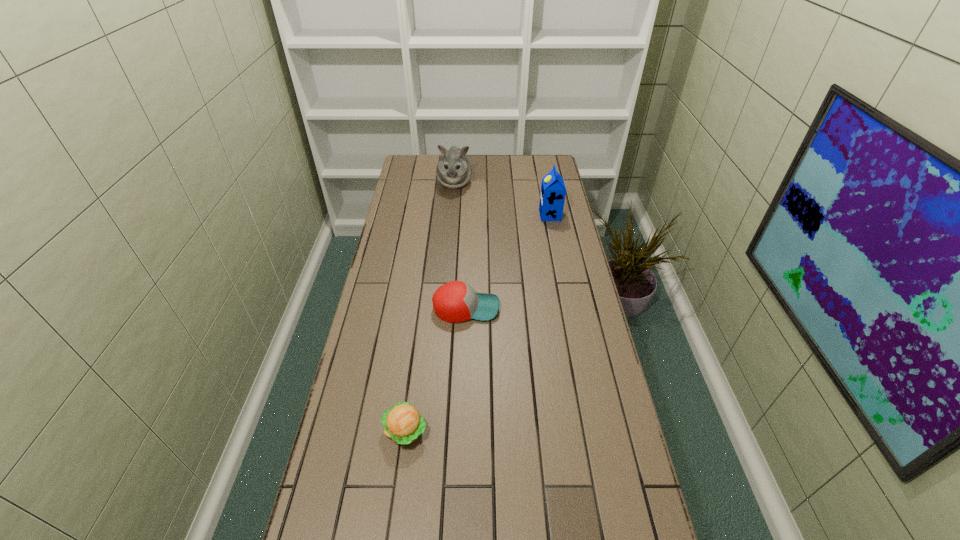
The image size is (960, 540). I want to click on free space located on the right of the nearest object, so click(496, 431).

This screenshot has height=540, width=960. Find the location of `object situated at the far edge`. object situated at the far edge is located at coordinates (453, 170).

The width and height of the screenshot is (960, 540). Find the location of `object positioned at the left edge`. object positioned at the left edge is located at coordinates (402, 423).

You are a GUI agent. You are given a task and a screenshot of the screen. Output one action in this format:
    pyautogui.click(x=<x>, y=<y>)
    Task: Click on the object that is positioned at the right edge
    
    Given the screenshot: What is the action you would take?
    pyautogui.click(x=552, y=197)

This screenshot has width=960, height=540. I want to click on vacant space at the far edge, so click(524, 172).

Where is `free region at the left edge of the desktop`? This screenshot has height=540, width=960. free region at the left edge of the desktop is located at coordinates (409, 218).

Identify the location of vacant space at the right edge of the desktop. (577, 278).

Locate an element on the screen. free spot at the far right corner of the desktop is located at coordinates (524, 163).

The image size is (960, 540). In order to click on blank region between the baseball cap and the hamster in this screenshot , I will do `click(460, 246)`.

The image size is (960, 540). I want to click on free space between the hamster and the third nearest object, so click(502, 199).